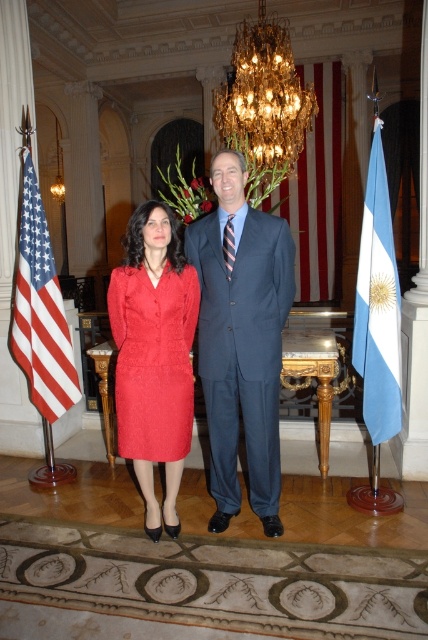
Question: Which object is farther from the camera taking this photo?

Choices:
 (A) blue fabric flag at right
 (B) gold crystal chandelier at upper center

Answer: (B)

Question: Observing the image, what is the correct spatial positioning of blue fabric flag at right in reference to white striped fabric flag at left?

Choices:
 (A) below
 (B) above

Answer: (A)

Question: Is gold crystal chandelier at upper center smaller than red/white striped flag at center?

Choices:
 (A) no
 (B) yes

Answer: (A)

Question: Which object is closer to the camera taking this photo?

Choices:
 (A) gold crystal chandelier at upper center
 (B) dark blue suit at center

Answer: (B)

Question: Is matte red dress at center closer to camera compared to red/white striped flag at center?

Choices:
 (A) yes
 (B) no

Answer: (A)

Question: Estimate the real-world distances between objects in this image. Which object is closer to the red/white striped flag at center?

Choices:
 (A) matte red dress at center
 (B) blue fabric flag at right
 (C) dark blue suit at center

Answer: (B)